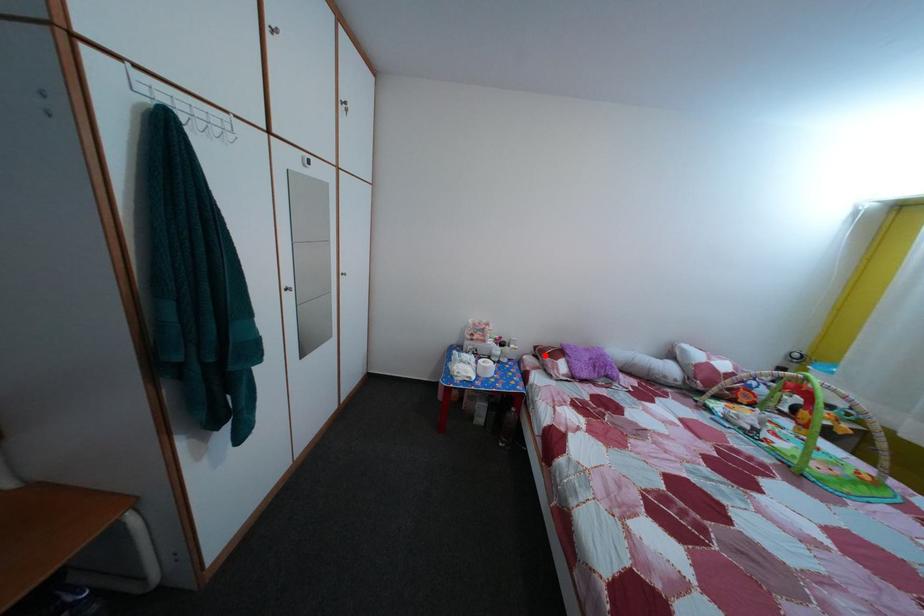
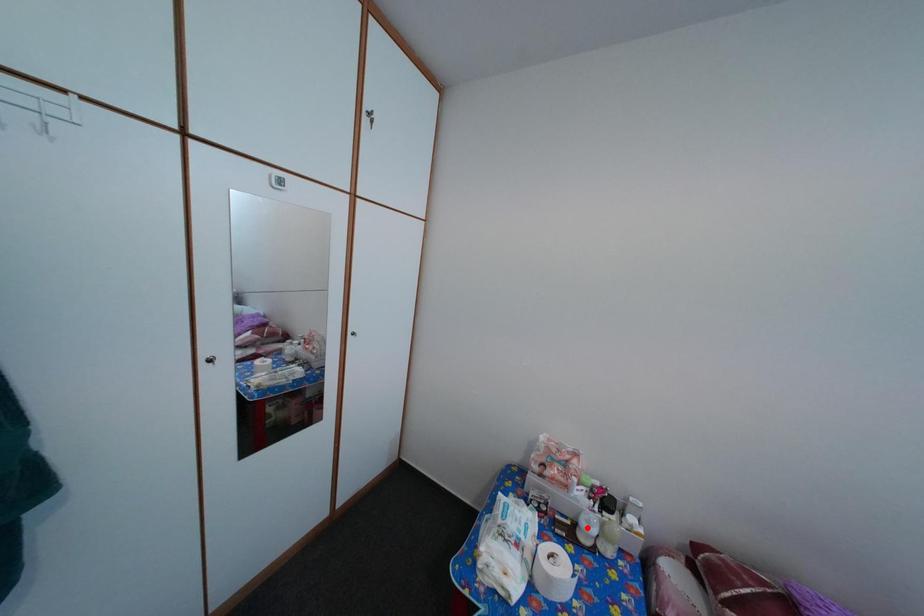
I am providing you with two images of the same scene from different viewpoints. A red point is marked on the first image and another point is marked on the second image. Is the red point in image1 aligned with the point shown in image2?

No